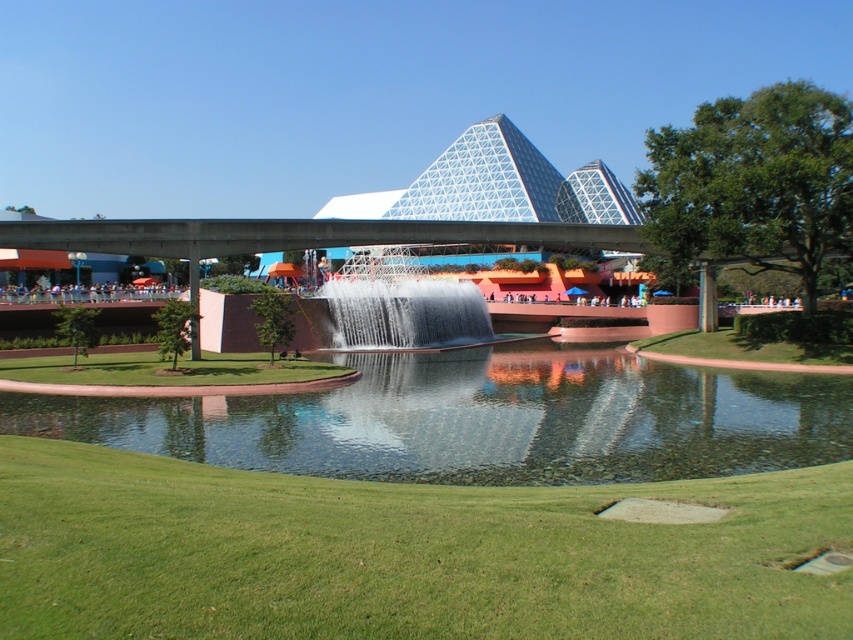
Who is shorter, clear glass lake at center or clear glass waterfall at center?

Standing shorter between the two is clear glass lake at center.

Does point (543, 420) lie behind point (328, 307)?

No, (543, 420) is in front of (328, 307).

Locate an element on the screen. clear glass lake at center is located at coordinates (482, 419).

Can you confirm if green grassy golf course at lower center is taller than clear glass lake at center?

Yes, green grassy golf course at lower center is taller than clear glass lake at center.

The image size is (853, 640). Find the location of `green grassy golf course at lower center`. green grassy golf course at lower center is located at coordinates point(402,554).

The height and width of the screenshot is (640, 853). What are the coordinates of `green grassy golf course at lower center` in the screenshot? It's located at (402, 554).

Which is below, green grassy golf course at lower center or clear glass waterfall at center?

green grassy golf course at lower center

Can you confirm if green grassy golf course at lower center is shorter than clear glass waterfall at center?

Yes, green grassy golf course at lower center is shorter than clear glass waterfall at center.

Is point (724, 625) positioned behind point (419, 312)?

No, (724, 625) is closer to viewer.

Locate an element on the screen. green grassy golf course at lower center is located at coordinates (402, 554).